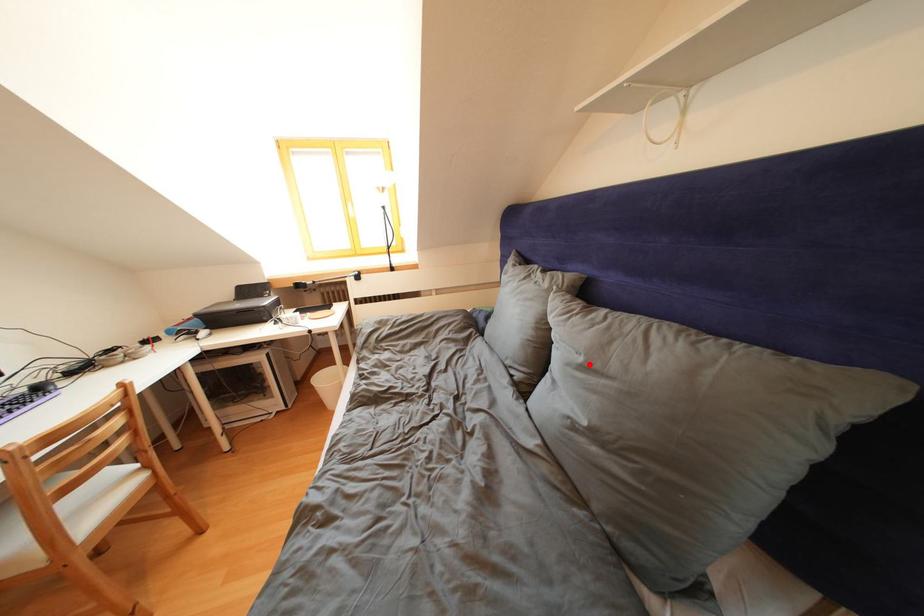
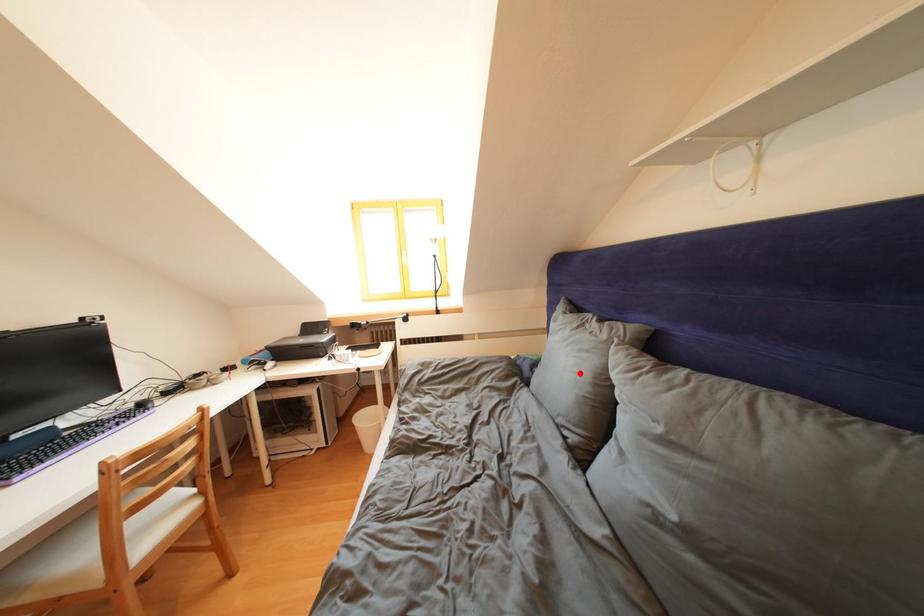
I am providing you with two images of the same scene from different viewpoints. A red point is marked on the first image and another point is marked on the second image. Are the points marked in image1 and image2 representing the same 3D position?

No